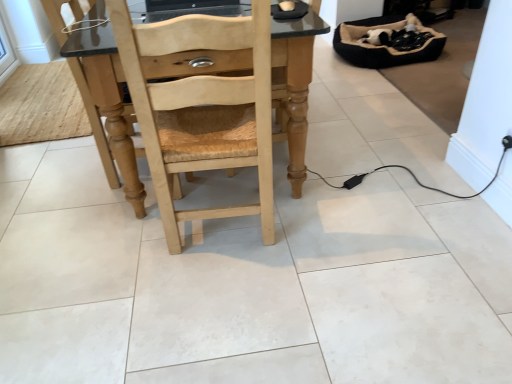
Find the location of `free location in front of natural wood chair at center`. free location in front of natural wood chair at center is located at coordinates (224, 303).